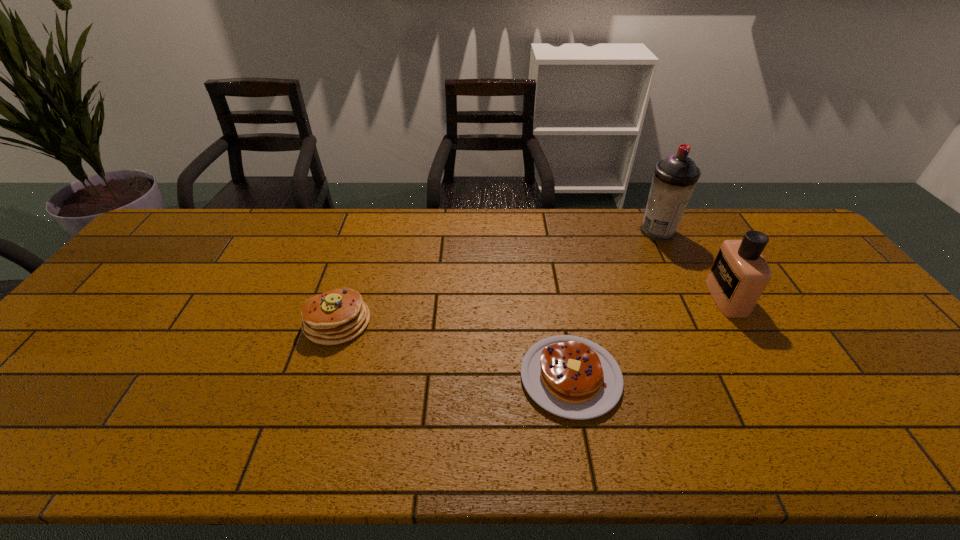
Identify the location of vacant area situated on the front label of the perfume. This screenshot has height=540, width=960. (586, 298).

Find the location of a particular element. vacant space located 0.370m on the right of the taller pancake is located at coordinates (508, 322).

I want to click on free spot located on the back of the shorter pancake, so click(549, 258).

Find the location of a particular element. The height and width of the screenshot is (540, 960). object situated at the far edge is located at coordinates (675, 177).

I want to click on object that is at the near edge, so click(572, 377).

Find the location of a particular element. This screenshot has width=960, height=540. free space at the far edge of the desktop is located at coordinates (388, 234).

What are the coordinates of `vacant position at the near edge of the desktop` in the screenshot? It's located at (564, 458).

Where is `vacant space at the right edge of the desktop`? Image resolution: width=960 pixels, height=540 pixels. vacant space at the right edge of the desktop is located at coordinates (913, 401).

Identify the location of free space between the second shortest object and the second object from left to right. The image size is (960, 540). (454, 349).

Locate an element on the screen. This screenshot has height=540, width=960. vacant space that's between the right pancake and the leftmost object is located at coordinates (454, 349).